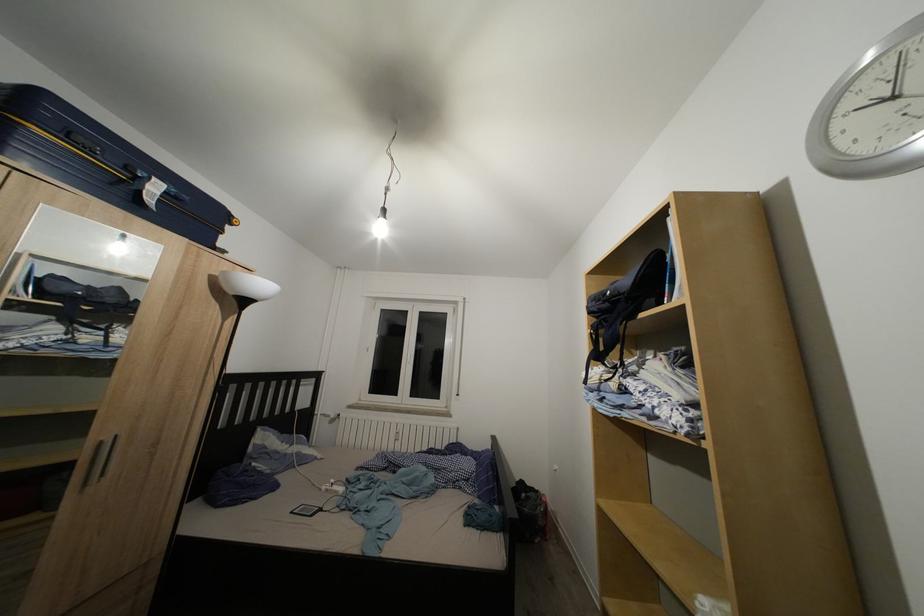
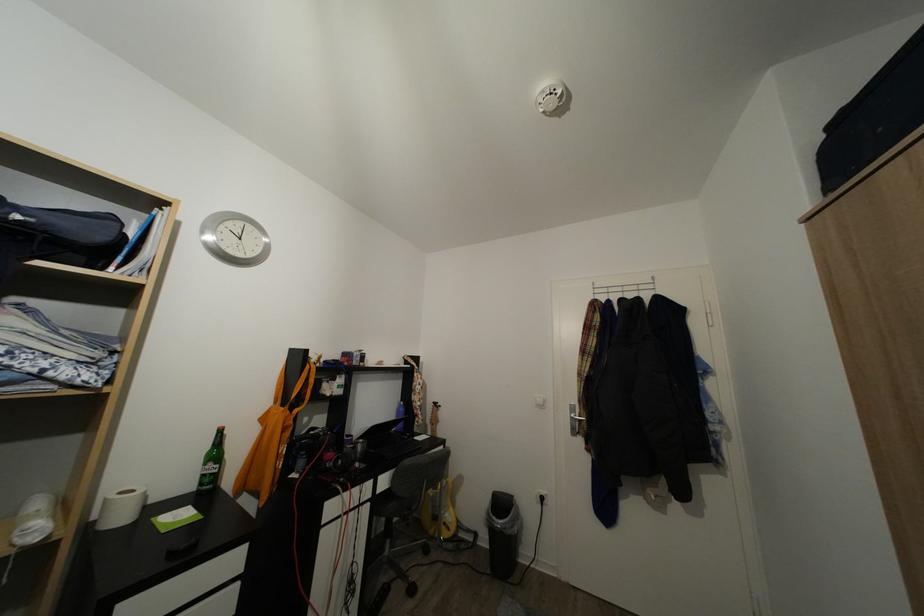
Where in the second image is the point corresponding to point (616, 299) from the first image?

(25, 223)